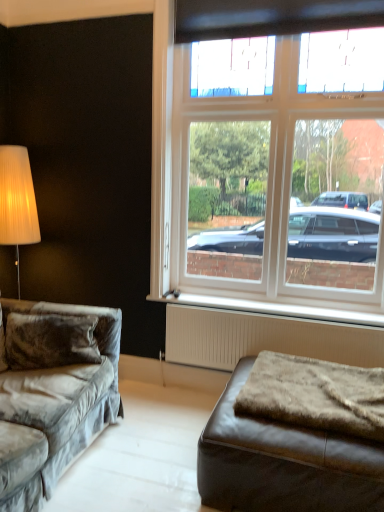
Question: From a real-world perspective, is velvet gray couch at left located higher than white glass window at center?

Choices:
 (A) no
 (B) yes

Answer: (A)

Question: Is velvet gray couch at left wider than white glass window at center?

Choices:
 (A) no
 (B) yes

Answer: (B)

Question: Could white glass window at center be considered to be inside velvet gray couch at left?

Choices:
 (A) no
 (B) yes

Answer: (A)

Question: Is velvet gray couch at left to the left of white glass window at center from the viewer's perspective?

Choices:
 (A) no
 (B) yes

Answer: (B)

Question: Considering the relative sizes of velvet gray couch at left and white glass window at center in the image provided, is velvet gray couch at left taller than white glass window at center?

Choices:
 (A) yes
 (B) no

Answer: (B)

Question: Is velvet gray couch at left directly adjacent to white glass window at center?

Choices:
 (A) no
 (B) yes

Answer: (A)

Question: Does white plastic radiator at lower center appear on the right side of velvet gray couch at left?

Choices:
 (A) no
 (B) yes

Answer: (B)

Question: From the image's perspective, would you say white plastic radiator at lower center is shown under velvet gray couch at left?

Choices:
 (A) yes
 (B) no

Answer: (B)

Question: Can you confirm if white plastic radiator at lower center is bigger than velvet gray couch at left?

Choices:
 (A) yes
 (B) no

Answer: (B)

Question: Is white plastic radiator at lower center wider than velvet gray couch at left?

Choices:
 (A) no
 (B) yes

Answer: (A)

Question: From the image's perspective, is white plastic radiator at lower center located above velvet gray couch at left?

Choices:
 (A) yes
 (B) no

Answer: (A)

Question: Is velvet gray couch at left completely or partially inside white plastic radiator at lower center?

Choices:
 (A) no
 (B) yes

Answer: (A)

Question: Does velvet gray couch at left appear on the left side of fuzzy brown blanket at lower right?

Choices:
 (A) yes
 (B) no

Answer: (A)